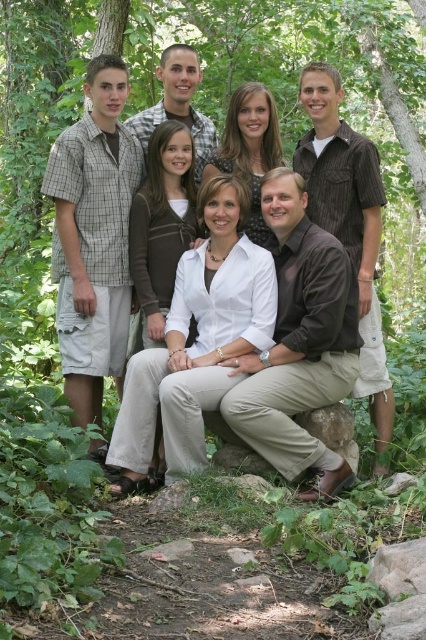
You are a photographer trying to capture a group photo of the matte white shirt at center and the brown rough stone at lower center. Which object is positioned higher in the frame?

The matte white shirt at center is much taller than the brown rough stone at lower center, so it is positioned higher in the frame.

Consider the image. You are a photographer trying to capture a group photo of the matte white shirt at center and the brown rough stone at lower center. Based on their positions, which object is positioned to the right side of the other?

The matte white shirt at center is to the right of the brown rough stone at lower center.